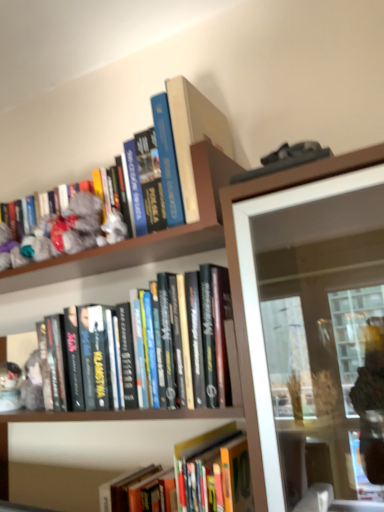
Question: Considering the positions of hardcover books at center, acting as the 3th book starting from the top, and hardcover book at center, which is the fourth book from top to bottom, in the image, is hardcover books at center, acting as the 3th book starting from the top, taller or shorter than hardcover book at center, which is the fourth book from top to bottom,?

Choices:
 (A) tall
 (B) short

Answer: (A)

Question: Considering their positions, is hardcover books at center, which ranks as the 2th book in bottom-to-top order, located in front of or behind hardcover book at center, which is the fourth book from top to bottom?

Choices:
 (A) front
 (B) behind

Answer: (B)

Question: Which object is the farthest from the hardcover book at center, which is the fourth book from top to bottom?

Choices:
 (A) hardcover books at center, acting as the 3th book starting from the top
 (B) hardcover book at upper center, which is the 4th book in bottom-to-top order
 (C) hardcover book at upper center, the 3th book from the bottom
 (D) fuzzy fabric toy at upper left

Answer: (B)

Question: Which object is positioned farthest from the hardcover book at center, which is the fourth book from top to bottom?

Choices:
 (A) fuzzy fabric toy at upper left
 (B) hardcover book at upper center, the 1th book when ordered from top to bottom
 (C) hardcover book at upper center, which appears as the 2th book when viewed from the top
 (D) hardcover books at center, acting as the 3th book starting from the top

Answer: (B)